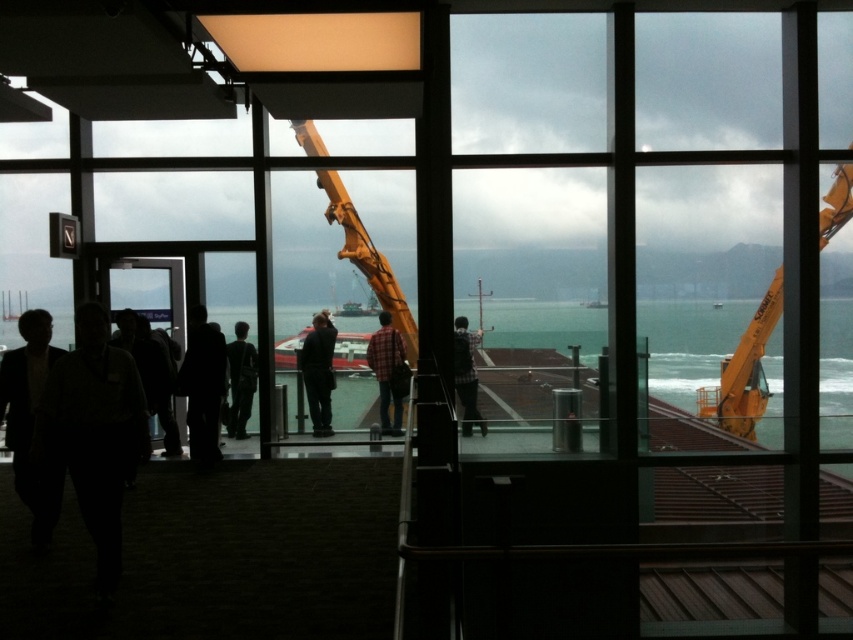
Question: Is silhouette clothing at center closer to the viewer compared to plaid shirt at center?

Choices:
 (A) no
 (B) yes

Answer: (B)

Question: Which object appears farthest from the camera in this image?

Choices:
 (A) dark suit at left
 (B) dark gray pants at center
 (C) dark gray suit at center
 (D) silhouette clothing at center

Answer: (B)

Question: Among these objects, which one is farthest from the camera?

Choices:
 (A) plaid fabric shirt at center
 (B) dark gray pants at center
 (C) dark suit at left

Answer: (B)

Question: Which point is farther from the camera taking this photo?

Choices:
 (A) (386, 401)
 (B) (16, 448)

Answer: (A)

Question: Can you confirm if plaid fabric shirt at center is positioned to the right of dark gray suit at center?

Choices:
 (A) yes
 (B) no

Answer: (A)

Question: Is dark gray suit at center bigger than plaid shirt at center?

Choices:
 (A) yes
 (B) no

Answer: (A)